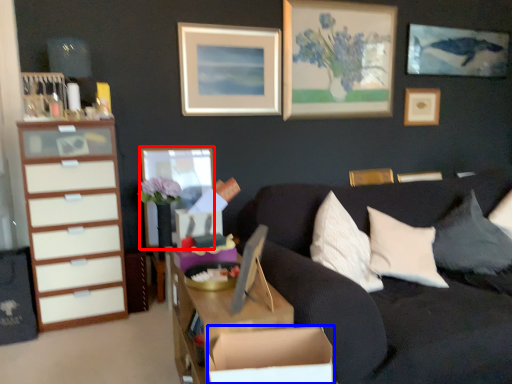
Question: Which of the following is the closest to the observer, picture frame (highlighted by a red box) or cardboard box (highlighted by a blue box)?

Choices:
 (A) picture frame
 (B) cardboard box

Answer: (B)